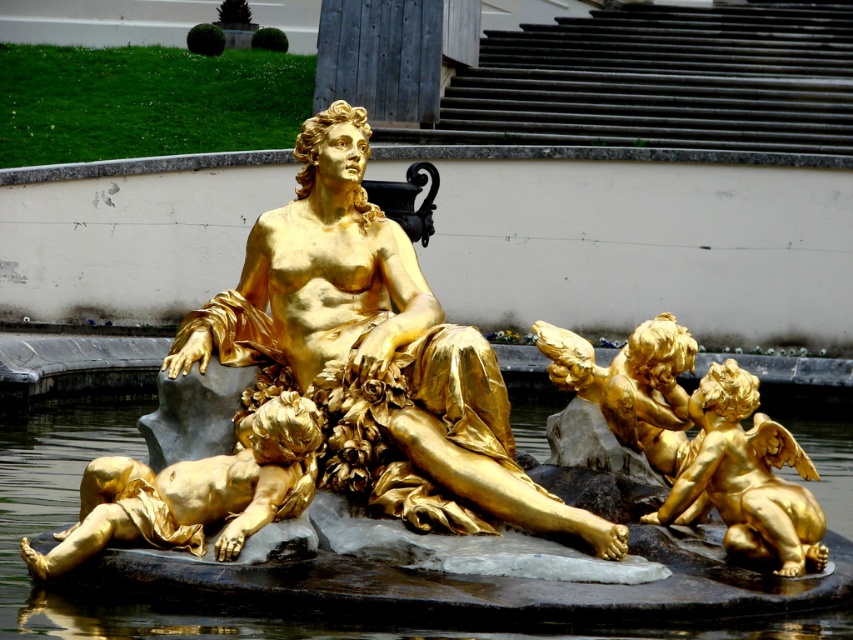
Question: Can you confirm if shiny metallic water at center is bigger than golden polished cherub at right?

Choices:
 (A) yes
 (B) no

Answer: (A)

Question: Which object is closer to the camera taking this photo?

Choices:
 (A) gold polished cherub at lower left
 (B) gold polished statue at center
 (C) golden polished cherub at right

Answer: (B)

Question: Can you confirm if gold polished statue at center is positioned to the right of shiny metallic water at center?

Choices:
 (A) yes
 (B) no

Answer: (A)

Question: Which object is farther from the camera taking this photo?

Choices:
 (A) shiny metallic water at center
 (B) gold polished statue at center
 (C) golden polished cherub at right

Answer: (C)

Question: Estimate the real-world distances between objects in this image. Which object is farther from the gold polished statue at center?

Choices:
 (A) shiny metallic water at center
 (B) gold polished cherub at lower left
 (C) golden polished cherub at right

Answer: (C)

Question: Does shiny metallic water at center appear over golden polished cherub at right?

Choices:
 (A) no
 (B) yes

Answer: (B)